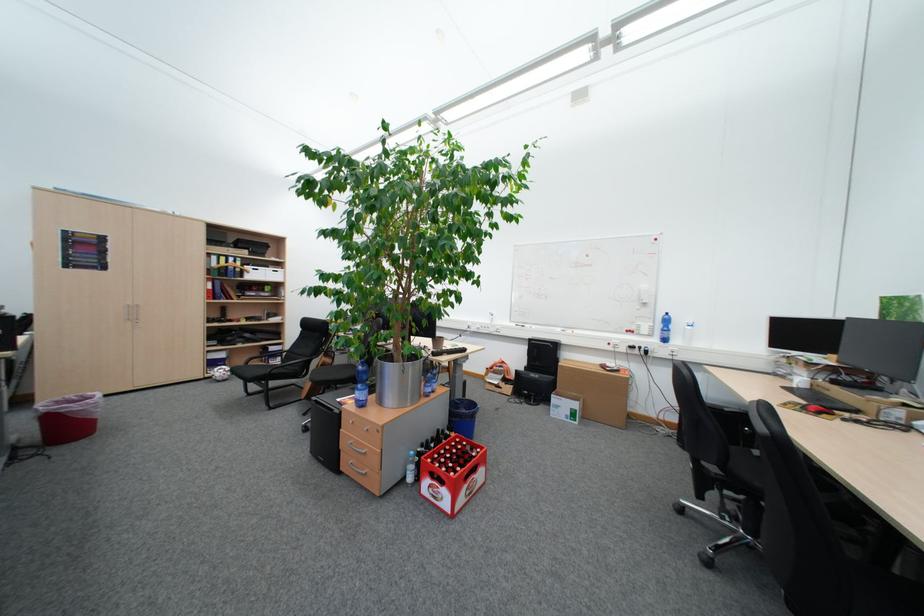
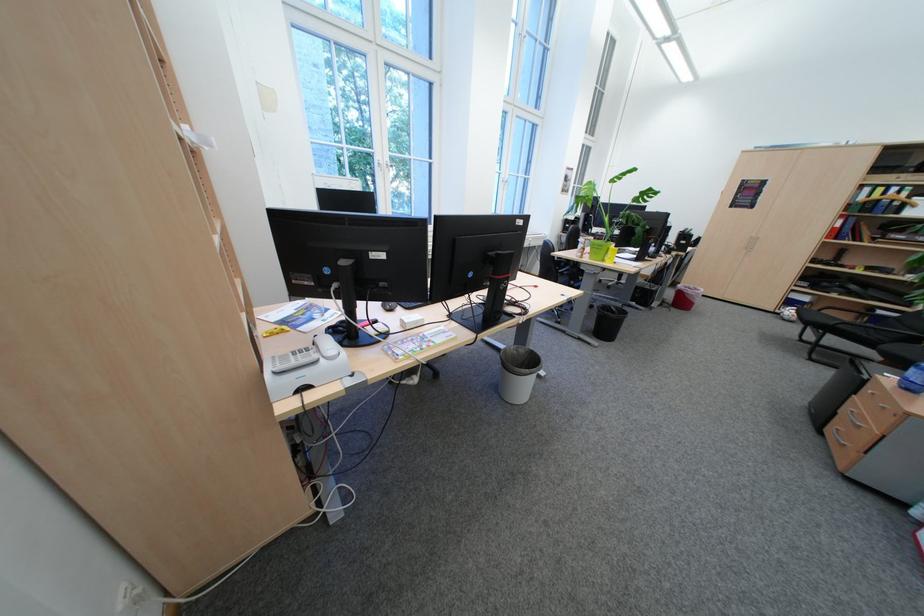
Find the pixel in the second image that matches [235,259] in the first image.

(893, 190)